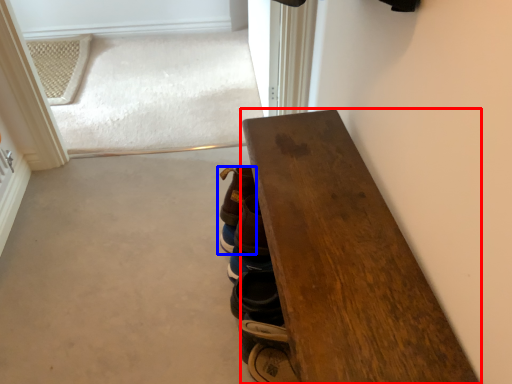
Question: Which point is further to the camera, table (highlighted by a red box) or footwear (highlighted by a blue box)?

Choices:
 (A) table
 (B) footwear

Answer: (B)